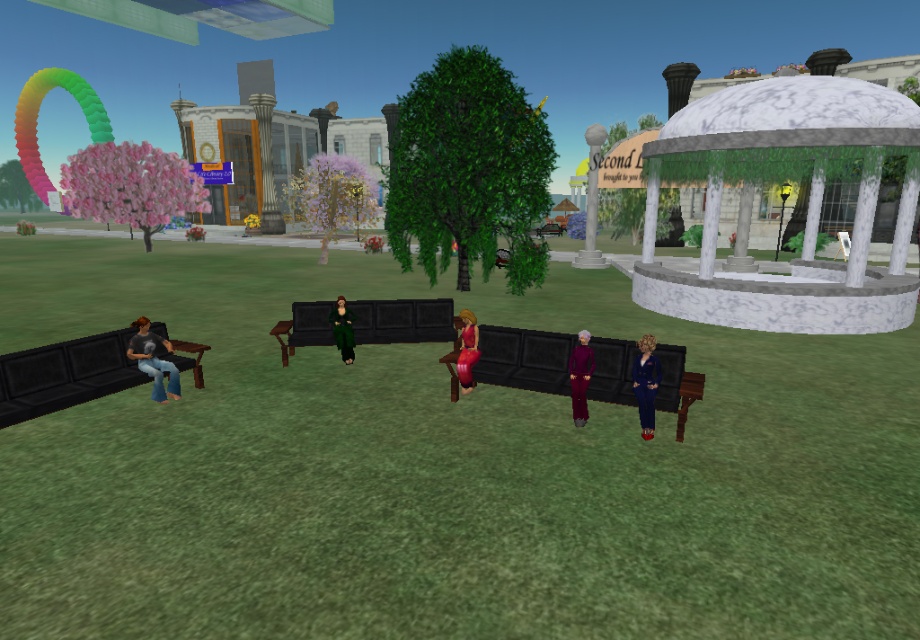
You are standing in the middle of the grassy area and see the shiny red dress at center and the shiny green coat at center. Which one is positioned to the right side?

The shiny red dress at center is positioned to the right of the shiny green coat at center.

You are standing at the entrance of the gazebo and want to reach both the shiny black bench at center and the purple velvet dress at center. Which object is closer to you?

The shiny black bench at center and the purple velvet dress at center are both at center, so they are equidistant from you.